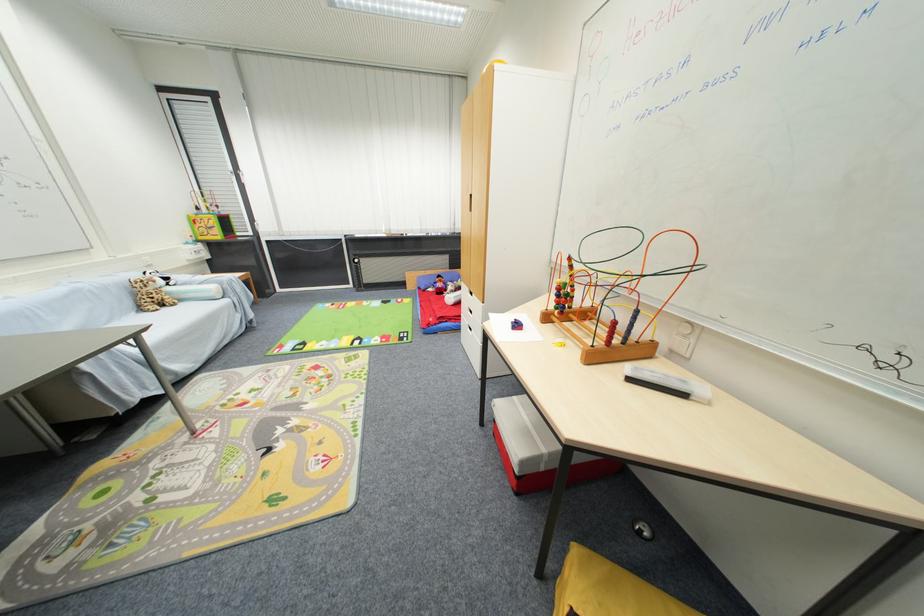
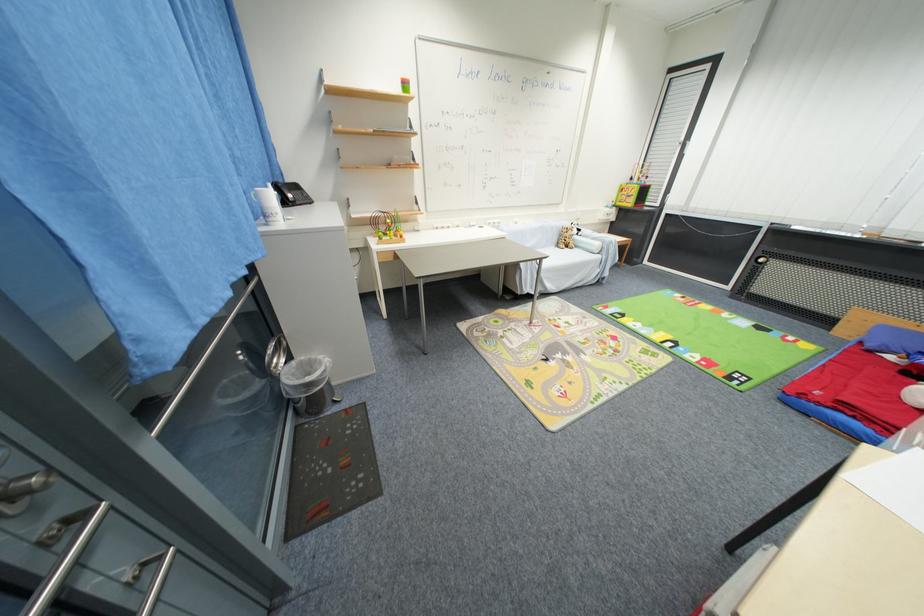
Locate, in the second image, the point that corresponds to pixel 223 238 in the first image.

(635, 206)